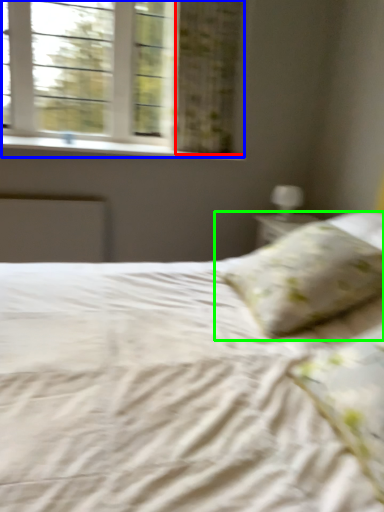
Question: Based on their relative distances, which object is nearer to curtain (highlighted by a red box)? Choose from window (highlighted by a blue box) and pillow (highlighted by a green box).

Choices:
 (A) window
 (B) pillow

Answer: (A)